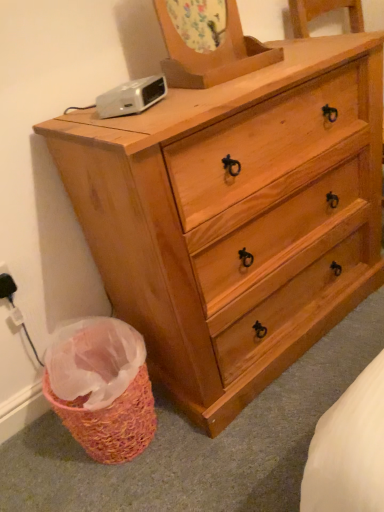
Locate an element on the screen. white plastic clock at upper left is located at coordinates (131, 97).

Identify the location of white plastic clock at upper left. Image resolution: width=384 pixels, height=512 pixels. point(131,97).

Is black plastic electric outlet at lower left at the right side of white plastic clock at upper left?

No, black plastic electric outlet at lower left is not to the right of white plastic clock at upper left.

Is black plastic electric outlet at lower left bigger or smaller than white plastic clock at upper left?

In the image, black plastic electric outlet at lower left appears to be smaller than white plastic clock at upper left.

How distant is black plastic electric outlet at lower left from white plastic clock at upper left?

A distance of 21.91 inches exists between black plastic electric outlet at lower left and white plastic clock at upper left.

Is white plastic clock at upper left at the back of black plastic electric outlet at lower left?

No, black plastic electric outlet at lower left is not facing away from white plastic clock at upper left.

Can you confirm if white plastic clock at upper left is wider than natural wood dresser at center?

No.

Looking at this image, is white plastic clock at upper left looking in the opposite direction of natural wood dresser at center?

Yes, natural wood dresser at center is at the back of white plastic clock at upper left.

Does white plastic clock at upper left have a larger size compared to natural wood dresser at center?

Incorrect, white plastic clock at upper left is not larger than natural wood dresser at center.

Which object is closer to the camera taking this photo, white plastic clock at upper left or black plastic electric outlet at lower left?

white plastic clock at upper left.

From the image's perspective, relative to black plastic electric outlet at lower left, is white plastic clock at upper left above or below?

Based on their image positions, white plastic clock at upper left is located above black plastic electric outlet at lower left.

At what (x,y) coordinates should I click in order to perform the action: click on electric outlet behind the white plastic clock at upper left. Please return your answer as a coordinate pair (x, y). Image resolution: width=384 pixels, height=512 pixels. Looking at the image, I should click on (6, 283).

Consider the image. Is white plastic clock at upper left with black plastic electric outlet at lower left?

There is a gap between white plastic clock at upper left and black plastic electric outlet at lower left.

Looking at this image, from the image's perspective, is natural wood dresser at center located beneath black plastic electric outlet at lower left?

No, from the image's perspective, natural wood dresser at center is not below black plastic electric outlet at lower left.

Consider the image. Considering the sizes of objects natural wood dresser at center and black plastic electric outlet at lower left in the image provided, who is thinner, natural wood dresser at center or black plastic electric outlet at lower left?

black plastic electric outlet at lower left is thinner.

Considering the relative sizes of natural wood dresser at center and black plastic electric outlet at lower left in the image provided, is natural wood dresser at center taller than black plastic electric outlet at lower left?

Correct, natural wood dresser at center is much taller as black plastic electric outlet at lower left.

Is black plastic electric outlet at lower left looking in the opposite direction of natural wood dresser at center?

No, black plastic electric outlet at lower left is not facing the opposite direction of natural wood dresser at center.

Between black plastic electric outlet at lower left and natural wood dresser at center, which one has smaller width?

Thinner between the two is black plastic electric outlet at lower left.

Can you confirm if black plastic electric outlet at lower left is positioned to the right of natural wood dresser at center?

No, black plastic electric outlet at lower left is not to the right of natural wood dresser at center.

In the scene shown: Considering the relative sizes of black plastic electric outlet at lower left and natural wood dresser at center in the image provided, is black plastic electric outlet at lower left smaller than natural wood dresser at center?

Correct, black plastic electric outlet at lower left occupies less space than natural wood dresser at center.

From the image's perspective, is natural wood dresser at center over white plastic clock at upper left?

Actually, natural wood dresser at center appears below white plastic clock at upper left in the image.

You are a GUI agent. You are given a task and a screenshot of the screen. Output one action in this format:
    pyautogui.click(x=<x>, y=<y>)
    Task: Click on the gadget that is above the natural wood dresser at center (from a real-world perspective)
    The image size is (384, 512).
    Given the screenshot: What is the action you would take?
    pyautogui.click(x=131, y=97)

From a real-world perspective, is natural wood dresser at center over white plastic clock at upper left?

Incorrect, from a real-world perspective, natural wood dresser at center is lower than white plastic clock at upper left.

How distant is natural wood dresser at center from white plastic clock at upper left?

natural wood dresser at center is 41.97 centimeters away from white plastic clock at upper left.

Image resolution: width=384 pixels, height=512 pixels. What are the coordinates of `electric outlet on the left of white plastic clock at upper left` in the screenshot? It's located at (6, 283).

Locate an element on the screen. The image size is (384, 512). chest of drawers on the right of white plastic clock at upper left is located at coordinates (235, 217).

Which object lies further to the anchor point white plastic clock at upper left, black plastic electric outlet at lower left or natural wood dresser at center?

black plastic electric outlet at lower left.

Which object lies nearer to the anchor point natural wood dresser at center, white plastic clock at upper left or black plastic electric outlet at lower left?

white plastic clock at upper left is closer to natural wood dresser at center.

Based on the photo, considering their positions, is natural wood dresser at center positioned closer to white plastic clock at upper left than black plastic electric outlet at lower left?

natural wood dresser at center is closer to white plastic clock at upper left.

From the image, which object appears to be farther from black plastic electric outlet at lower left, natural wood dresser at center or white plastic clock at upper left?

Based on the image, natural wood dresser at center appears to be further to black plastic electric outlet at lower left.

Based on their spatial positions, is black plastic electric outlet at lower left or white plastic clock at upper left further from natural wood dresser at center?

Among the two, black plastic electric outlet at lower left is located further to natural wood dresser at center.

From the image, which object appears to be farther from black plastic electric outlet at lower left, white plastic clock at upper left or natural wood dresser at center?

The object further to black plastic electric outlet at lower left is natural wood dresser at center.

This screenshot has width=384, height=512. Find the location of `gadget located between black plastic electric outlet at lower left and natural wood dresser at center in the left-right direction`. gadget located between black plastic electric outlet at lower left and natural wood dresser at center in the left-right direction is located at coordinates (131, 97).